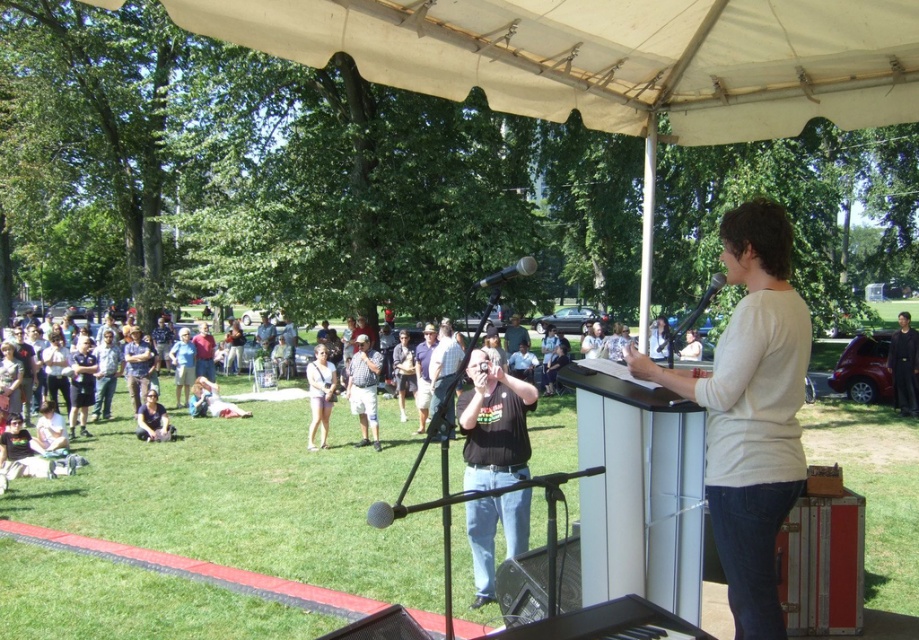
You are a photographer positioned at the back of the crowd. You want to take a photo of the plaid fabric shirt at center without the white fabric canopy at upper center blocking the view. Is this possible?

The white fabric canopy at upper center is closer to the viewer than the plaid fabric shirt at center, so the canopy would block the view of the shirt. Therefore, it is not possible to take a photo of the plaid fabric shirt at center without the white fabric canopy at upper center blocking the view.